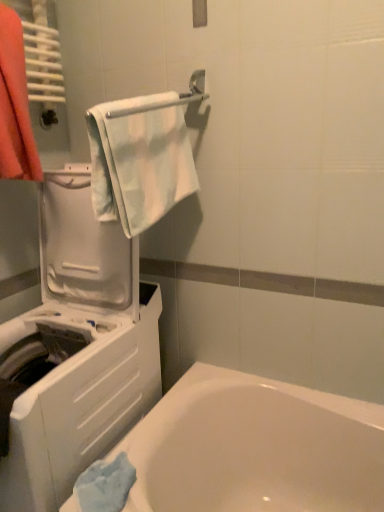
Question: Is orange cotton towel at left at the right side of white glossy bathtub at lower left?

Choices:
 (A) no
 (B) yes

Answer: (A)

Question: Is orange cotton towel at left behind white glossy bathtub at lower left?

Choices:
 (A) yes
 (B) no

Answer: (A)

Question: From the image's perspective, does orange cotton towel at left appear lower than white glossy bathtub at lower left?

Choices:
 (A) yes
 (B) no

Answer: (B)

Question: Is orange cotton towel at left positioned with its back to white glossy bathtub at lower left?

Choices:
 (A) yes
 (B) no

Answer: (B)

Question: Can you confirm if orange cotton towel at left is bigger than white glossy bathtub at lower left?

Choices:
 (A) yes
 (B) no

Answer: (B)

Question: From the image's perspective, is orange cotton towel at left on white glossy bathtub at lower left?

Choices:
 (A) no
 (B) yes

Answer: (B)

Question: Considering the relative positions of white glossy towel bar at upper center and white plastic washing machine at left in the image provided, is white glossy towel bar at upper center to the right of white plastic washing machine at left from the viewer's perspective?

Choices:
 (A) yes
 (B) no

Answer: (A)

Question: From a real-world perspective, does white glossy towel bar at upper center stand above white plastic washing machine at left?

Choices:
 (A) yes
 (B) no

Answer: (A)

Question: From a real-world perspective, is white glossy towel bar at upper center positioned under white plastic washing machine at left based on gravity?

Choices:
 (A) no
 (B) yes

Answer: (A)

Question: Is white glossy towel bar at upper center beside white plastic washing machine at left?

Choices:
 (A) no
 (B) yes

Answer: (A)

Question: Is the depth of white glossy towel bar at upper center less than that of white plastic washing machine at left?

Choices:
 (A) no
 (B) yes

Answer: (A)

Question: Is white glossy towel bar at upper center turned away from white plastic washing machine at left?

Choices:
 (A) yes
 (B) no

Answer: (B)

Question: Is light blue fabric towel at upper center placed right next to white glossy bathtub at lower left?

Choices:
 (A) no
 (B) yes

Answer: (A)